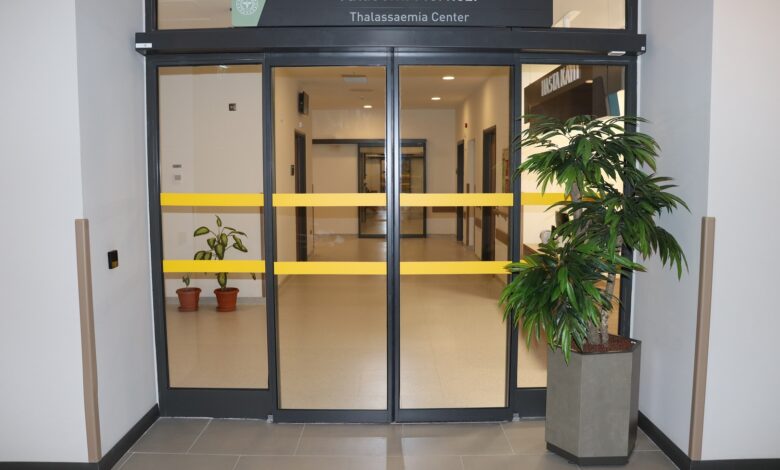
Locate an element on the screen. Image resolution: width=780 pixels, height=470 pixels. white wall surfaces closest to viewer is located at coordinates (44, 133), (738, 177).